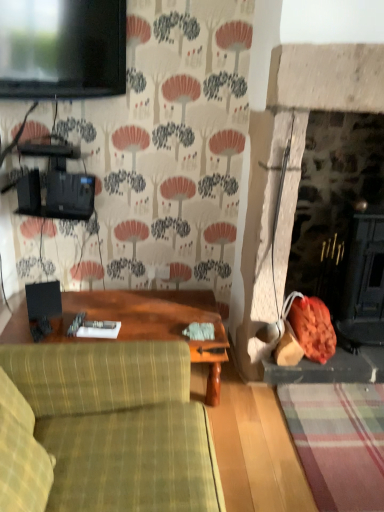
Measure the distance between green plaid fabric couch at lower left and camera.

The depth of green plaid fabric couch at lower left is 3.83 feet.

Image resolution: width=384 pixels, height=512 pixels. Find the location of `green plaid fabric couch at lower left`. green plaid fabric couch at lower left is located at coordinates (119, 425).

This screenshot has width=384, height=512. Describe the element at coordinates (62, 49) in the screenshot. I see `matte black tv at upper left` at that location.

You are a GUI agent. You are given a task and a screenshot of the screen. Output one action in this format:
    pyautogui.click(x=<x>, y=<y>)
    Task: Click on the green plaid fabric couch at lower left
    This screenshot has height=512, width=384.
    Given the screenshot: What is the action you would take?
    pyautogui.click(x=119, y=425)

Are matte black tv at upper left and green plaid fabric couch at lower left located far from each other?

Yes, matte black tv at upper left and green plaid fabric couch at lower left are quite far apart.

Is matte black tv at upper left to the left of green plaid fabric couch at lower left from the viewer's perspective?

Indeed, matte black tv at upper left is positioned on the left side of green plaid fabric couch at lower left.

Consider the image. From a real-world perspective, which is physically below, matte black tv at upper left or green plaid fabric couch at lower left?

In real-world perspective, green plaid fabric couch at lower left is lower.

Can you confirm if green plaid fabric couch at lower left is thinner than matte black tv at upper left?

Incorrect, the width of green plaid fabric couch at lower left is not less than that of matte black tv at upper left.

Identify the location of studio couch that is in front of the matte black tv at upper left. Image resolution: width=384 pixels, height=512 pixels. (119, 425).

From a real-world perspective, is green plaid fabric couch at lower left beneath matte black tv at upper left?

Indeed, from a real-world perspective, green plaid fabric couch at lower left is positioned beneath matte black tv at upper left.

How different are the orientations of green plaid fabric couch at lower left and matte black tv at upper left in degrees?

52 degrees separate the facing orientations of green plaid fabric couch at lower left and matte black tv at upper left.

Is wooden table at center smaller than matte black tv at upper left?

No, wooden table at center is not smaller than matte black tv at upper left.

This screenshot has height=512, width=384. I want to click on television above the wooden table at center (from a real-world perspective), so click(x=62, y=49).

Choose the correct answer: Is wooden table at center inside matte black tv at upper left or outside it?

The correct answer is: outside.

Can you confirm if wooden table at center is thinner than matte black tv at upper left?

Incorrect, the width of wooden table at center is not less than that of matte black tv at upper left.

Is green plaid fabric couch at lower left at the left side of wooden table at center?

In fact, green plaid fabric couch at lower left is to the right of wooden table at center.

Is green plaid fabric couch at lower left far away from wooden table at center?

No, green plaid fabric couch at lower left is not far from wooden table at center.

Considering the sizes of green plaid fabric couch at lower left and wooden table at center in the image, is green plaid fabric couch at lower left wider or thinner than wooden table at center?

Clearly, green plaid fabric couch at lower left has more width compared to wooden table at center.

From a real-world perspective, does green plaid fabric couch at lower left sit lower than wooden table at center?

Actually, green plaid fabric couch at lower left is physically above wooden table at center in the real world.

Does matte black tv at upper left have a smaller size compared to wooden table at center?

Yes, matte black tv at upper left is smaller than wooden table at center.

Would you say wooden table at center is part of matte black tv at upper left's contents?

No.

From the image's perspective, is matte black tv at upper left on wooden table at center?

Yes, from the image's perspective, matte black tv at upper left is over wooden table at center.

From the picture: Is wooden table at center at the back of matte black tv at upper left?

No, matte black tv at upper left's orientation is not away from wooden table at center.

Which is in front, point (208, 356) or point (142, 385)?

Positioned in front is point (142, 385).

Which of these two, wooden table at center or green plaid fabric couch at lower left, is bigger?

green plaid fabric couch at lower left is bigger.

From a real-world perspective, is wooden table at center on top of green plaid fabric couch at lower left?

No.

Considering the positions of objects wooden table at center and green plaid fabric couch at lower left in the image provided, who is behind, wooden table at center or green plaid fabric couch at lower left?

wooden table at center is further from the camera.

The image size is (384, 512). Find the location of `television that appears behind the green plaid fabric couch at lower left`. television that appears behind the green plaid fabric couch at lower left is located at coordinates (62, 49).

Where is `studio couch below the matte black tv at upper left (from the image's perspective)`? studio couch below the matte black tv at upper left (from the image's perspective) is located at coordinates (119, 425).

Based on their spatial positions, is wooden table at center or matte black tv at upper left closer to green plaid fabric couch at lower left?

The object closer to green plaid fabric couch at lower left is wooden table at center.

Considering their positions, is matte black tv at upper left positioned closer to green plaid fabric couch at lower left than wooden table at center?

Based on the image, wooden table at center appears to be nearer to green plaid fabric couch at lower left.

Estimate the real-world distances between objects in this image. Which object is further from wooden table at center, green plaid fabric couch at lower left or matte black tv at upper left?

matte black tv at upper left lies further to wooden table at center than the other object.

Considering their positions, is matte black tv at upper left positioned closer to wooden table at center than green plaid fabric couch at lower left?

Based on the image, green plaid fabric couch at lower left appears to be nearer to wooden table at center.

Considering their positions, is green plaid fabric couch at lower left positioned closer to matte black tv at upper left than wooden table at center?

wooden table at center.

Which object lies nearer to the anchor point matte black tv at upper left, wooden table at center or green plaid fabric couch at lower left?

Among the two, wooden table at center is located nearer to matte black tv at upper left.

Where is `table between matte black tv at upper left and green plaid fabric couch at lower left in the vertical direction`? The height and width of the screenshot is (512, 384). table between matte black tv at upper left and green plaid fabric couch at lower left in the vertical direction is located at coordinates (152, 322).